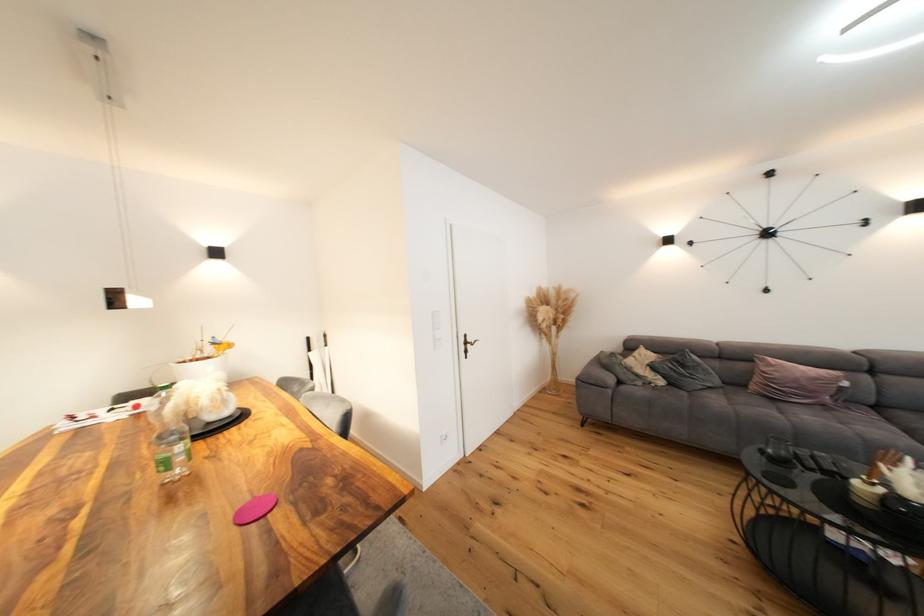
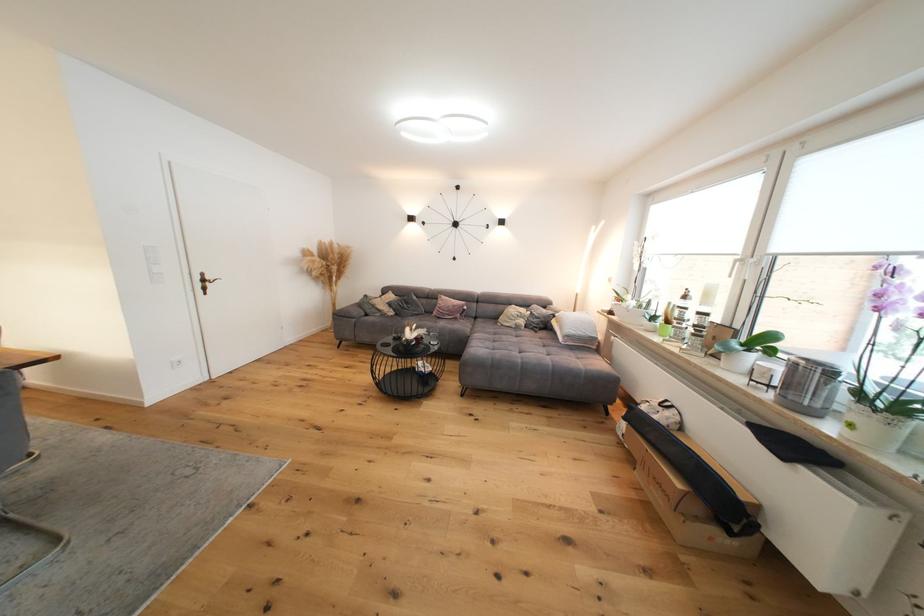
Find the pixel in the second image that matches the point at 617,381 in the first image.

(365, 314)